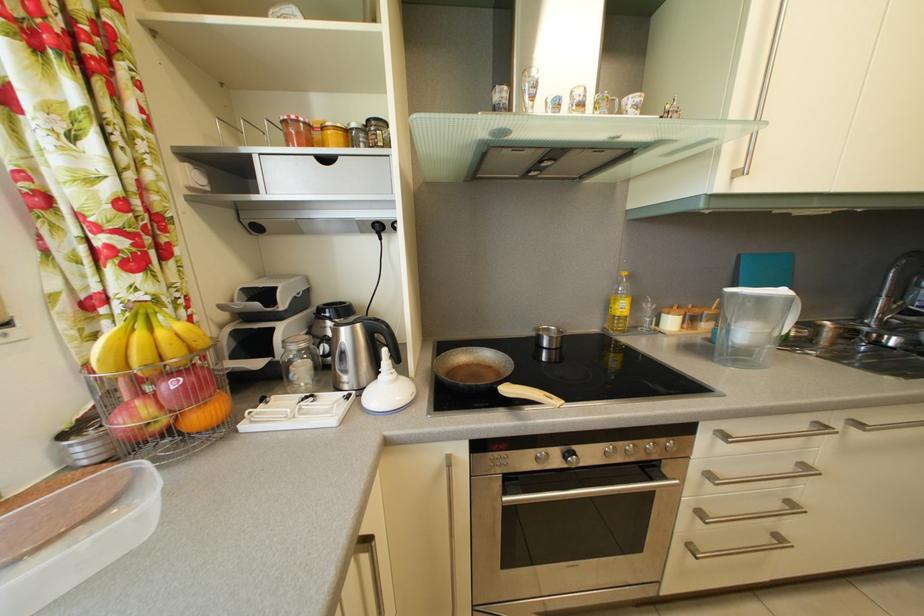
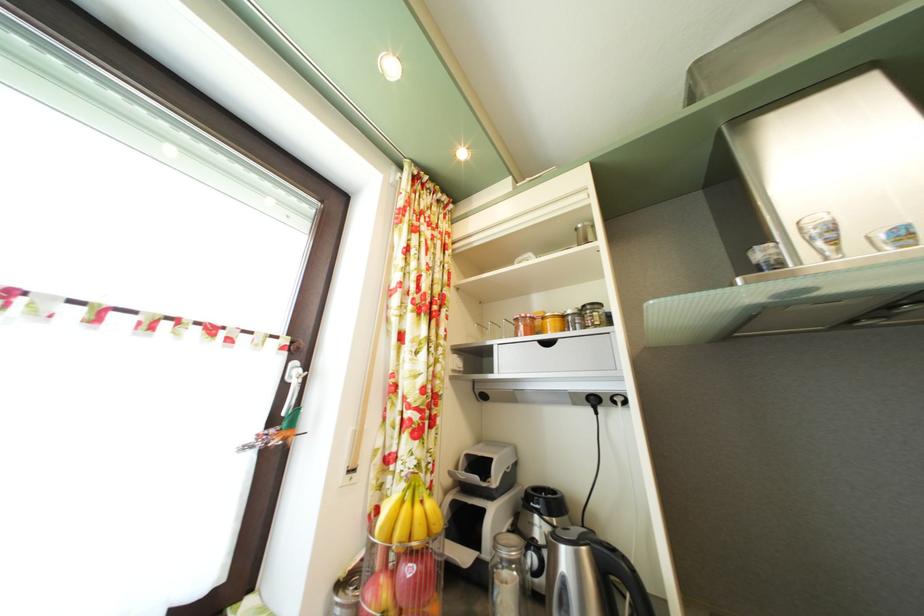
Find the pixel in the second image that matches point 181,391 in the first image.

(418, 578)